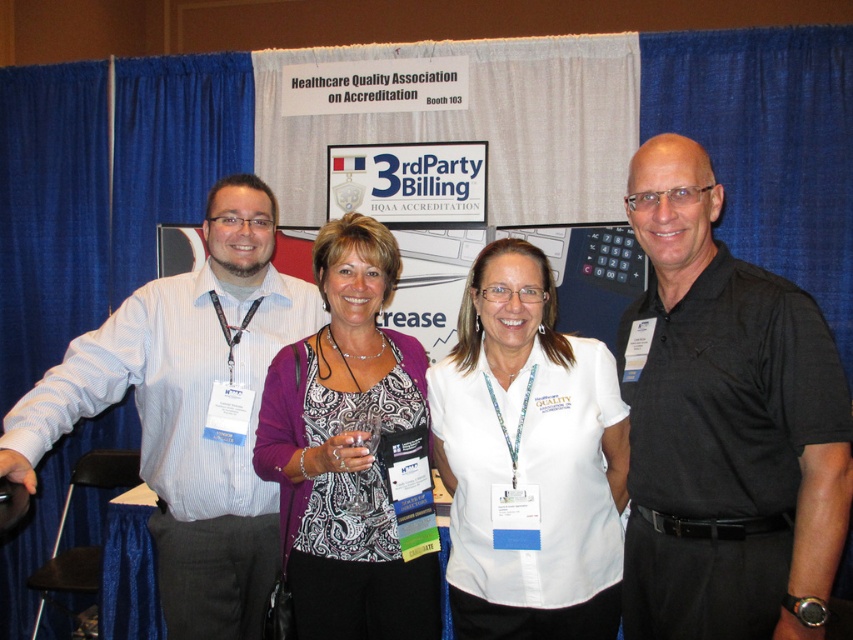
Question: Among these objects, which one is nearest to the camera?

Choices:
 (A) white striped shirt at center
 (B) black shirt at right
 (C) paisley-patterned blouse at center
 (D) white fabric shirt at center

Answer: (B)

Question: Is the position of black shirt at right less distant than that of white striped shirt at center?

Choices:
 (A) no
 (B) yes

Answer: (B)

Question: Which object is closer to the camera taking this photo?

Choices:
 (A) white striped shirt at center
 (B) paisley-patterned blouse at center
 (C) white fabric shirt at center
 (D) black shirt at right

Answer: (D)

Question: Which of these objects is positioned farthest from the black shirt at right?

Choices:
 (A) white fabric shirt at center
 (B) white striped shirt at center

Answer: (B)

Question: Where is black shirt at right located in relation to white striped shirt at center in the image?

Choices:
 (A) left
 (B) right

Answer: (B)

Question: Does white striped shirt at center have a larger size compared to white fabric shirt at center?

Choices:
 (A) no
 (B) yes

Answer: (B)